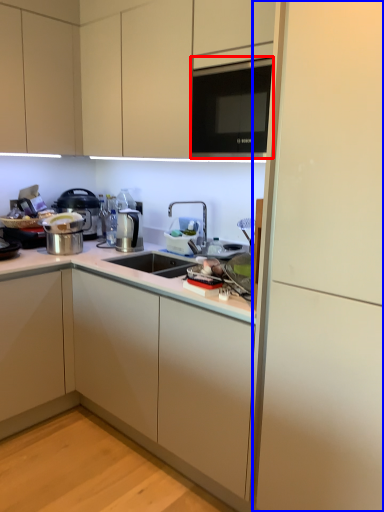
Question: Which object is further to the camera taking this photo, microwave (highlighted by a red box) or side (highlighted by a blue box)?

Choices:
 (A) microwave
 (B) side

Answer: (A)